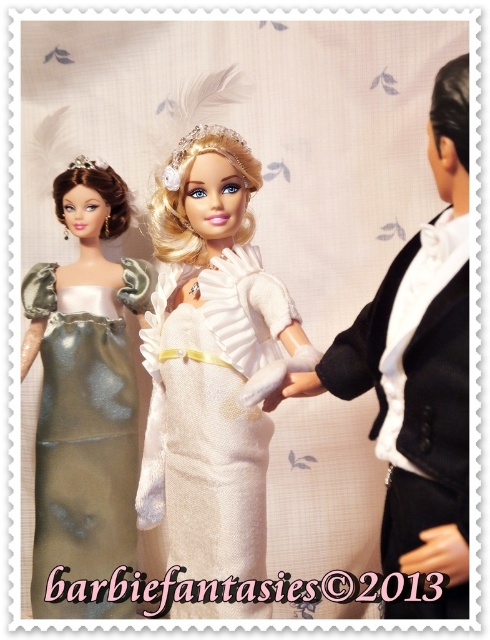
You are a photographer setting up a shoot with the dolls. You need to position a small prop between the satin metallic dress at left and the matte black hand at lower right. Considering their sizes, which object should the prop be placed closer to?

The satin metallic dress at left is larger in size than the matte black hand at lower right, so the prop should be placed closer to the matte black hand at lower right to maintain balance between the two objects.